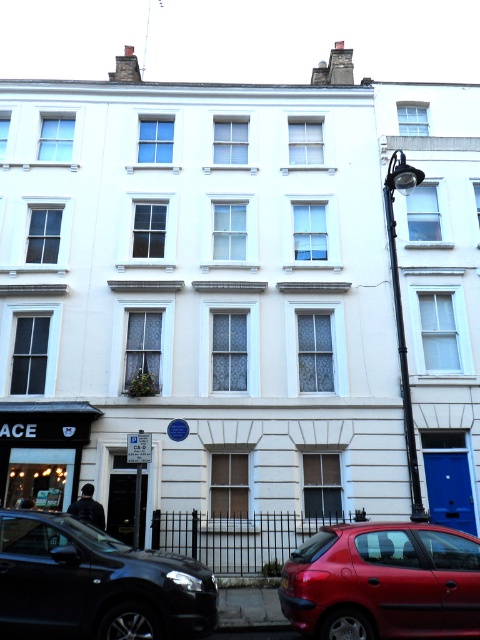
Describe the element at coordinates (96, 582) in the screenshot. I see `shiny black suv at lower left` at that location.

Where is `shiny black suv at lower left`? The height and width of the screenshot is (640, 480). shiny black suv at lower left is located at coordinates (96, 582).

Does point (47, 577) come in front of point (458, 544)?

Yes, point (47, 577) is closer to viewer.

Identify the location of shiny black suv at lower left. (96, 582).